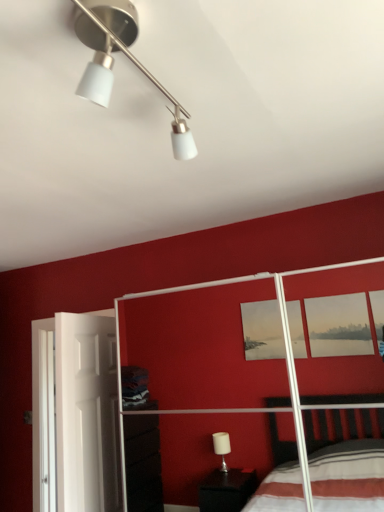
Locate an element on the screen. white matte track light at upper center is located at coordinates (113, 61).

What do you see at coordinates (158, 288) in the screenshot? I see `matte white bed frame at center` at bounding box center [158, 288].

The height and width of the screenshot is (512, 384). I want to click on white matte track light at upper center, so click(x=113, y=61).

Is matte white bed frame at center oriented away from white matte track light at upper center?

No, matte white bed frame at center is not facing the opposite direction of white matte track light at upper center.

Can you confirm if matte white bed frame at center is bigger than white matte track light at upper center?

Indeed, matte white bed frame at center has a larger size compared to white matte track light at upper center.

Is point (294, 220) positioned behind point (111, 85)?

Yes, it is.

Looking at this image, from the image's perspective, does matte white bed frame at center appear lower than white matte track light at upper center?

Yes, from the image's perspective, matte white bed frame at center is below white matte track light at upper center.

You are a GUI agent. You are given a task and a screenshot of the screen. Output one action in this format:
    pyautogui.click(x=<x>, y=<y>)
    Task: Click on the lamp above the matte white bed frame at center (from the image's perspective)
    
    Given the screenshot: What is the action you would take?
    pyautogui.click(x=113, y=61)

Is white matte track light at upper center wider than matte white bed frame at center?

No, white matte track light at upper center is not wider than matte white bed frame at center.

From a real-world perspective, between white matte track light at upper center and matte white bed frame at center, who is vertically lower?

matte white bed frame at center.

Would you say white matte track light at upper center is outside matte white bed frame at center?

white matte track light at upper center lies outside matte white bed frame at center's area.

Between white matte screen door at left and white matte track light at upper center, which one is positioned in front?

white matte track light at upper center.

Who is smaller, white matte screen door at left or white matte track light at upper center?

Smaller between the two is white matte track light at upper center.

Is white matte screen door at left placed right next to white matte track light at upper center?

No, white matte screen door at left is not touching white matte track light at upper center.

Which is closer, (x=103, y=20) or (x=52, y=422)?

Positioned in front is point (x=103, y=20).

From the image's perspective, which one is positioned higher, white matte track light at upper center or white matte screen door at left?

white matte track light at upper center appears higher in the image.

Is white matte track light at upper center to the left or to the right of white matte screen door at left in the image?

white matte track light at upper center is to the right of white matte screen door at left.

Looking at their sizes, would you say white matte screen door at left is wider or thinner than matte white bed frame at center?

Clearly, white matte screen door at left has less width compared to matte white bed frame at center.

From the image's perspective, which one is positioned higher, white matte screen door at left or matte white bed frame at center?

matte white bed frame at center.

Where is `backdrop in front of the white matte screen door at left`? The width and height of the screenshot is (384, 512). backdrop in front of the white matte screen door at left is located at coordinates [158, 288].

Which is more to the right, matte white bed frame at center or white matte screen door at left?

Positioned to the right is matte white bed frame at center.

Is matte white bed frame at center aimed at white matte screen door at left?

No, matte white bed frame at center is not facing towards white matte screen door at left.

Who is shorter, matte white bed frame at center or white matte screen door at left?

white matte screen door at left is shorter.

The height and width of the screenshot is (512, 384). What are the coordinates of `lamp above the matte white bed frame at center (from a real-world perspective)` in the screenshot? It's located at (113, 61).

Image resolution: width=384 pixels, height=512 pixels. Identify the location of lamp that is above the matte white bed frame at center (from the image's perspective). (113, 61).

Considering their positions, is white matte screen door at left positioned further to matte white bed frame at center than white matte track light at upper center?

white matte track light at upper center.

When comparing their distances from matte white bed frame at center, does white matte track light at upper center or white matte screen door at left seem further?

white matte track light at upper center is positioned further to the anchor matte white bed frame at center.

When comparing their distances from white matte screen door at left, does matte white bed frame at center or white matte track light at upper center seem further?

white matte track light at upper center lies further to white matte screen door at left than the other object.

From the image, which object appears to be nearer to white matte track light at upper center, matte white bed frame at center or white matte screen door at left?

Result: The object closer to white matte track light at upper center is white matte screen door at left.

From the image, which object appears to be farther from white matte screen door at left, white matte track light at upper center or matte white bed frame at center?

Based on the image, white matte track light at upper center appears to be further to white matte screen door at left.

Considering their positions, is white matte screen door at left positioned further to white matte track light at upper center than matte white bed frame at center?

Based on the image, matte white bed frame at center appears to be further to white matte track light at upper center.

What are the coordinates of `backdrop that lies between white matte track light at upper center and white matte screen door at left from top to bottom` in the screenshot? It's located at point(158,288).